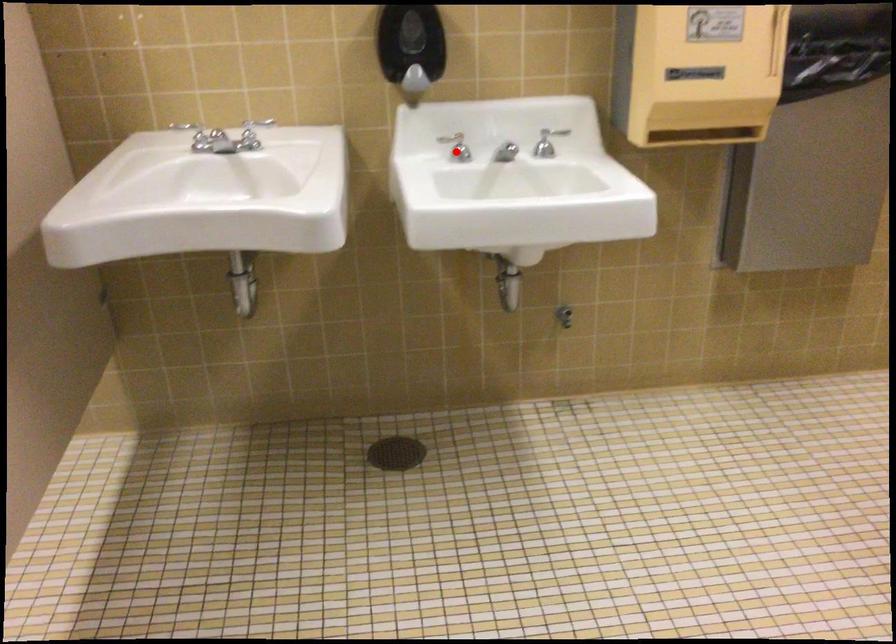
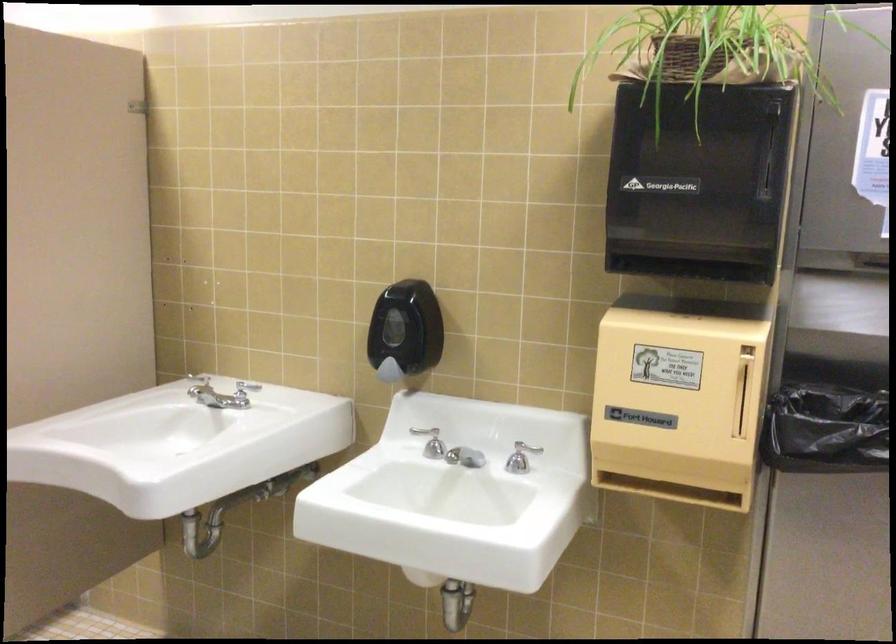
Where in the second image is the point corresponding to the highlighted location from the first image?

(433, 444)